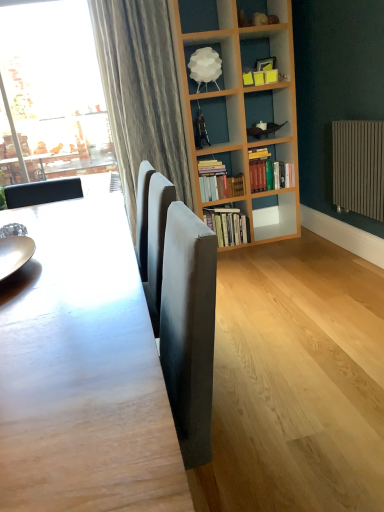
In order to face brown metallic radiator at right, should I rotate leftwards or rightwards?

A 21.765 degree turn to the right will do.

What do you see at coordinates (15, 254) in the screenshot?
I see `shiny metallic plate at left` at bounding box center [15, 254].

How much space does hardcover books at center, arranged as the first book when ordered from the bottom, occupy horizontally?

hardcover books at center, arranged as the first book when ordered from the bottom, is 11.10 inches wide.

Describe the element at coordinates (268, 170) in the screenshot. This screenshot has width=384, height=512. I see `hardcover books at center, which ranks as the 1th book in top-to-bottom order` at that location.

Find the location of a particular element. The image size is (384, 512). hardcover books at center, the third book in the bottom-to-top sequence is located at coordinates (268, 170).

Describe the element at coordinates (218, 181) in the screenshot. I see `hardcover books at center, the 2th book in the bottom-to-top sequence` at that location.

Locate an element on the screen. hardcover books at center, acting as the second book starting from the top is located at coordinates (218, 181).

The height and width of the screenshot is (512, 384). Identify the location of smooth wooden table at center. (83, 369).

Image resolution: width=384 pixels, height=512 pixels. I want to click on brown metallic radiator at right, so click(x=358, y=167).

Is hardcover books at center, the 3th book when ordered from top to bottom, at the back of white matte lampshade at upper center?

No, white matte lampshade at upper center is not facing the opposite direction of hardcover books at center, the 3th book when ordered from top to bottom.

This screenshot has height=512, width=384. I want to click on shelf above the hardcover books at center, arranged as the first book when ordered from the bottom (from the image's perspective), so click(x=219, y=56).

From the image's perspective, is white matte lampshade at upper center located beneath hardcover books at center, arranged as the first book when ordered from the bottom?

No.

Considering the points (192, 93) and (236, 233), which point is behind, point (192, 93) or point (236, 233)?

The point (236, 233) is behind.

In the scene shown: Is hardcover books at center, the 3th book when ordered from top to bottom, located outside hardcover books at center, acting as the second book starting from the top?

Absolutely, hardcover books at center, the 3th book when ordered from top to bottom, is external to hardcover books at center, acting as the second book starting from the top.

From a real-world perspective, does hardcover books at center, the 3th book when ordered from top to bottom, stand above hardcover books at center, the 2th book in the bottom-to-top sequence?

No, from a real-world perspective, hardcover books at center, the 3th book when ordered from top to bottom, is not on top of hardcover books at center, the 2th book in the bottom-to-top sequence.

Locate an element on the screen. Image resolution: width=384 pixels, height=512 pixels. book lying on the left of hardcover books at center, arranged as the first book when ordered from the bottom is located at coordinates (218, 181).

How far apart are hardcover books at center, arranged as the first book when ordered from the bottom, and hardcover books at center, acting as the second book starting from the top?

The distance of hardcover books at center, arranged as the first book when ordered from the bottom, from hardcover books at center, acting as the second book starting from the top, is 8.76 inches.

Considering the relative sizes of hardcover books at center, the 3th book when ordered from top to bottom, and smooth wooden table at center in the image provided, is hardcover books at center, the 3th book when ordered from top to bottom, shorter than smooth wooden table at center?

Yes, hardcover books at center, the 3th book when ordered from top to bottom, is shorter than smooth wooden table at center.

Is hardcover books at center, the 3th book when ordered from top to bottom, wider or thinner than smooth wooden table at center?

Considering their sizes, hardcover books at center, the 3th book when ordered from top to bottom, looks slimmer than smooth wooden table at center.

Is hardcover books at center, the 3th book when ordered from top to bottom, outside of smooth wooden table at center?

Absolutely, hardcover books at center, the 3th book when ordered from top to bottom, is external to smooth wooden table at center.

How much distance is there between hardcover books at center, arranged as the first book when ordered from the bottom, and smooth wooden table at center?

hardcover books at center, arranged as the first book when ordered from the bottom, and smooth wooden table at center are 2.04 meters apart.

This screenshot has height=512, width=384. I want to click on radiator on the right side of hardcover books at center, the 2th book in the bottom-to-top sequence, so click(358, 167).

Are brown metallic radiator at right and hardcover books at center, acting as the second book starting from the top, located far from each other?

No, brown metallic radiator at right is not far from hardcover books at center, acting as the second book starting from the top.

From a real-world perspective, does brown metallic radiator at right sit lower than hardcover books at center, acting as the second book starting from the top?

No, from a real-world perspective, brown metallic radiator at right is not under hardcover books at center, acting as the second book starting from the top.

Considering the sizes of objects brown metallic radiator at right and hardcover books at center, acting as the second book starting from the top, in the image provided, who is thinner, brown metallic radiator at right or hardcover books at center, acting as the second book starting from the top,?

brown metallic radiator at right is thinner.

Considering the relative positions of hardcover books at center, the third book in the bottom-to-top sequence, and shiny metallic plate at left in the image provided, is hardcover books at center, the third book in the bottom-to-top sequence, in front of shiny metallic plate at left?

No, hardcover books at center, the third book in the bottom-to-top sequence, is further to the viewer.

Is hardcover books at center, which ranks as the 1th book in top-to-bottom order, positioned with its back to shiny metallic plate at left?

hardcover books at center, which ranks as the 1th book in top-to-bottom order, is not turned away from shiny metallic plate at left.

From a real-world perspective, which object rests below the other?

hardcover books at center, the third book in the bottom-to-top sequence, from a real-world perspective.

From a real-world perspective, is white matte lampshade at upper center below brown metallic radiator at right?

No, from a real-world perspective, white matte lampshade at upper center is not beneath brown metallic radiator at right.

Considering the relative sizes of white matte lampshade at upper center and brown metallic radiator at right in the image provided, is white matte lampshade at upper center wider than brown metallic radiator at right?

Yes.

Visually, is white matte lampshade at upper center positioned to the left or to the right of brown metallic radiator at right?

In the image, white matte lampshade at upper center appears on the left side of brown metallic radiator at right.

Choose the correct answer: Is white matte lampshade at upper center inside brown metallic radiator at right or outside it?

white matte lampshade at upper center exists outside the volume of brown metallic radiator at right.

Is hardcover books at center, acting as the second book starting from the top, wider than white matte lampshade at upper center?

Incorrect, the width of hardcover books at center, acting as the second book starting from the top, does not surpass that of white matte lampshade at upper center.

From a real-world perspective, who is located lower, hardcover books at center, the 2th book in the bottom-to-top sequence, or white matte lampshade at upper center?

From a 3D spatial view, hardcover books at center, the 2th book in the bottom-to-top sequence, is below.

Considering the positions of objects hardcover books at center, acting as the second book starting from the top, and white matte lampshade at upper center in the image provided, who is behind, hardcover books at center, acting as the second book starting from the top, or white matte lampshade at upper center?

hardcover books at center, acting as the second book starting from the top, is behind.

The width and height of the screenshot is (384, 512). I want to click on shelf on the left of hardcover books at center, arranged as the first book when ordered from the bottom, so click(219, 56).

Identify the location of the 1st book positioned above the hardcover books at center, arranged as the first book when ordered from the bottom (from the image's perspective). The image size is (384, 512). (218, 181).

Which object lies nearer to the anchor point hardcover books at center, the 3th book when ordered from top to bottom, shiny metallic plate at left or smooth wooden table at center?

shiny metallic plate at left is positioned closer to the anchor hardcover books at center, the 3th book when ordered from top to bottom.

Based on the photo, looking at the image, which one is located further to hardcover books at center, which ranks as the 1th book in top-to-bottom order, smooth wooden table at center or white matte lampshade at upper center?

The object further to hardcover books at center, which ranks as the 1th book in top-to-bottom order, is smooth wooden table at center.

Based on their spatial positions, is hardcover books at center, acting as the second book starting from the top, or smooth wooden table at center further from hardcover books at center, arranged as the first book when ordered from the bottom?

smooth wooden table at center is further to hardcover books at center, arranged as the first book when ordered from the bottom.

Based on their spatial positions, is white matte lampshade at upper center or smooth wooden table at center closer to shiny metallic plate at left?

Among the two, smooth wooden table at center is located nearer to shiny metallic plate at left.

Which object lies further to the anchor point hardcover books at center, arranged as the first book when ordered from the bottom, hardcover books at center, the third book in the bottom-to-top sequence, or brown metallic radiator at right?

brown metallic radiator at right is further to hardcover books at center, arranged as the first book when ordered from the bottom.

Considering their positions, is white matte lampshade at upper center positioned closer to hardcover books at center, arranged as the first book when ordered from the bottom, than hardcover books at center, the third book in the bottom-to-top sequence?

Based on the image, hardcover books at center, the third book in the bottom-to-top sequence, appears to be nearer to hardcover books at center, arranged as the first book when ordered from the bottom.

Based on their spatial positions, is smooth wooden table at center or brown metallic radiator at right further from hardcover books at center, which ranks as the 1th book in top-to-bottom order?

smooth wooden table at center is further to hardcover books at center, which ranks as the 1th book in top-to-bottom order.

Considering their positions, is shiny metallic plate at left positioned closer to hardcover books at center, which ranks as the 1th book in top-to-bottom order, than brown metallic radiator at right?

brown metallic radiator at right is closer to hardcover books at center, which ranks as the 1th book in top-to-bottom order.

Locate an element on the screen. Image resolution: width=384 pixels, height=512 pixels. book between white matte lampshade at upper center and hardcover books at center, the 2th book in the bottom-to-top sequence, in the vertical direction is located at coordinates (268, 170).

Identify the location of shelf between brown metallic radiator at right and hardcover books at center, the third book in the bottom-to-top sequence, from front to back. The width and height of the screenshot is (384, 512). (219, 56).

You are a GUI agent. You are given a task and a screenshot of the screen. Output one action in this format:
    pyautogui.click(x=<x>, y=<y>)
    Task: Click on the book positioned between shiny metallic plate at left and hardcover books at center, the third book in the bottom-to-top sequence, from near to far
    The width and height of the screenshot is (384, 512).
    Given the screenshot: What is the action you would take?
    pyautogui.click(x=218, y=181)

Locate an element on the screen. The height and width of the screenshot is (512, 384). plate between smooth wooden table at center and hardcover books at center, the 3th book when ordered from top to bottom, from front to back is located at coordinates (15, 254).